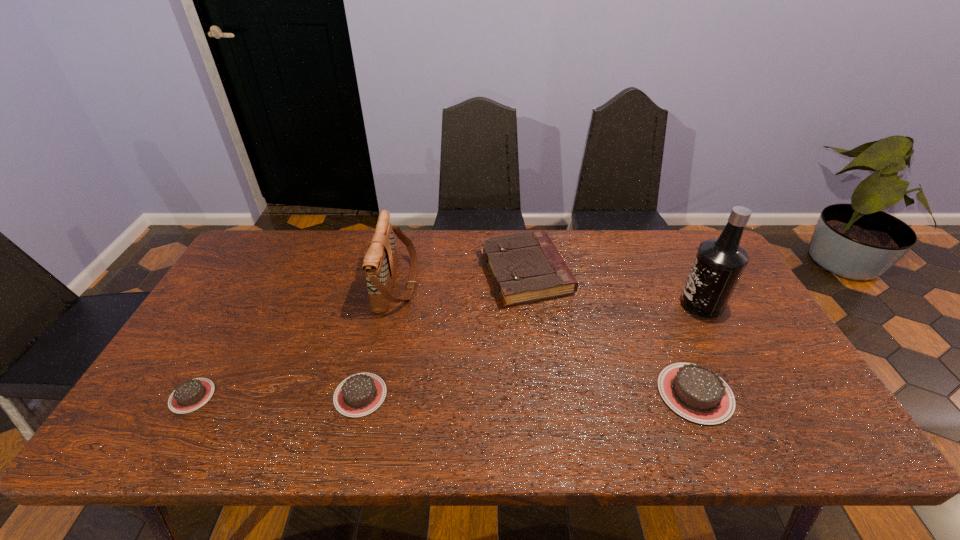
Please point a location where one more chocolate_cake can be added evenly. Please provide its 2D coordinates. Your answer should be formatted as a tuple, i.e. [(x, y)], where the tuple contains the x and y coordinates of a point satisfying the conditions above.

[(528, 394)]